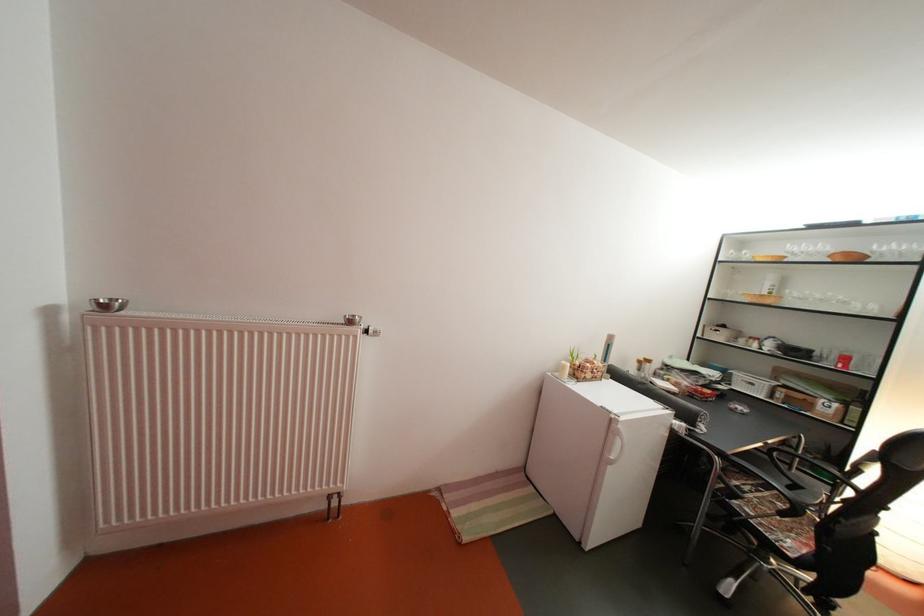
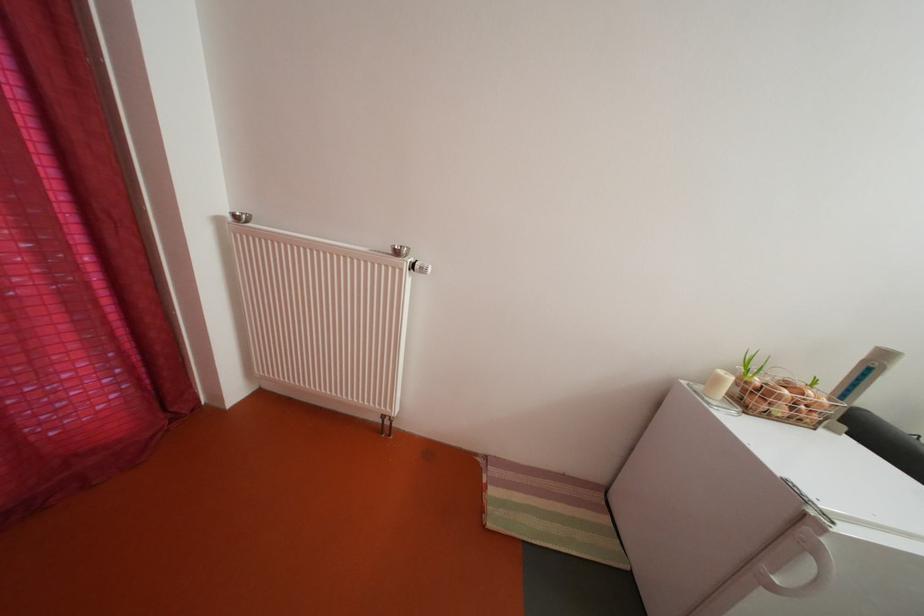
Question: The camera is either moving clockwise (left) or counter-clockwise (right) around the object. The first image is from the beginning of the video and the second image is from the end. Is the camera moving left or right when shooting the video?

Choices:
 (A) Left
 (B) Right

Answer: (B)